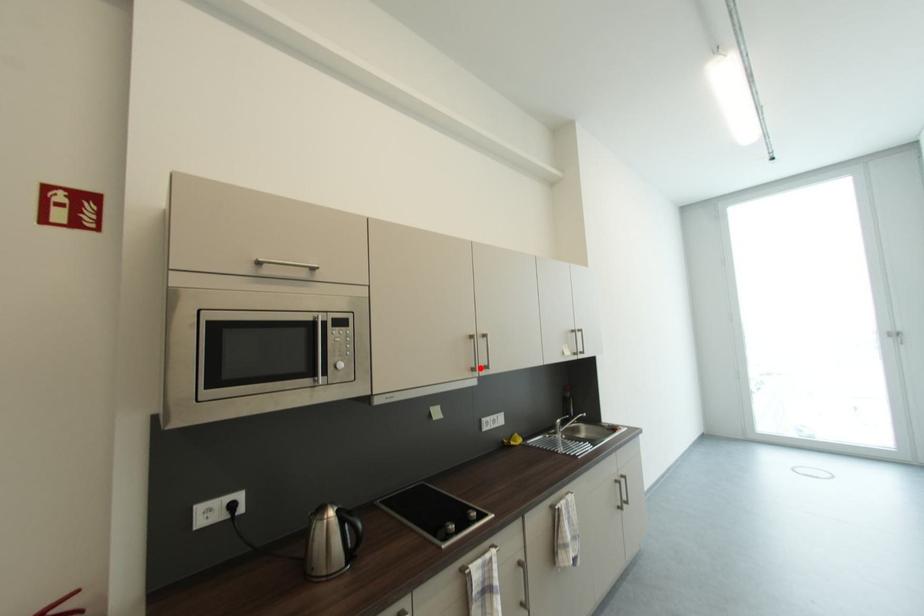
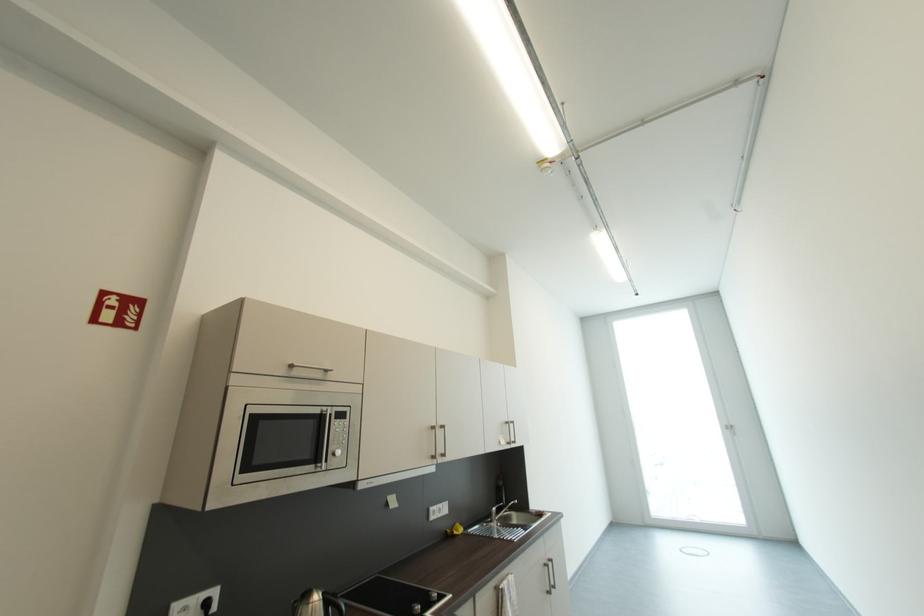
Find the pixel in the second image that matches the highlighted location in the first image.

(440, 456)